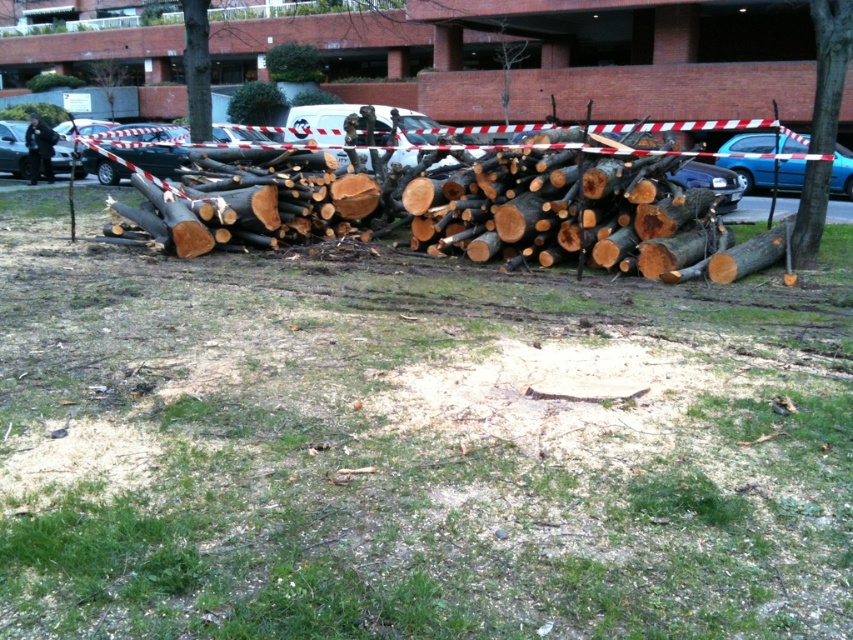
You are a gardener trying to mow the lawn. You see the green grass at center and the metallic silver car at left. Which direction should you move the lawnmower to avoid hitting the car?

The green grass at center is to the right of metallic silver car at left, so you should move the lawnmower to the right to avoid hitting the car.